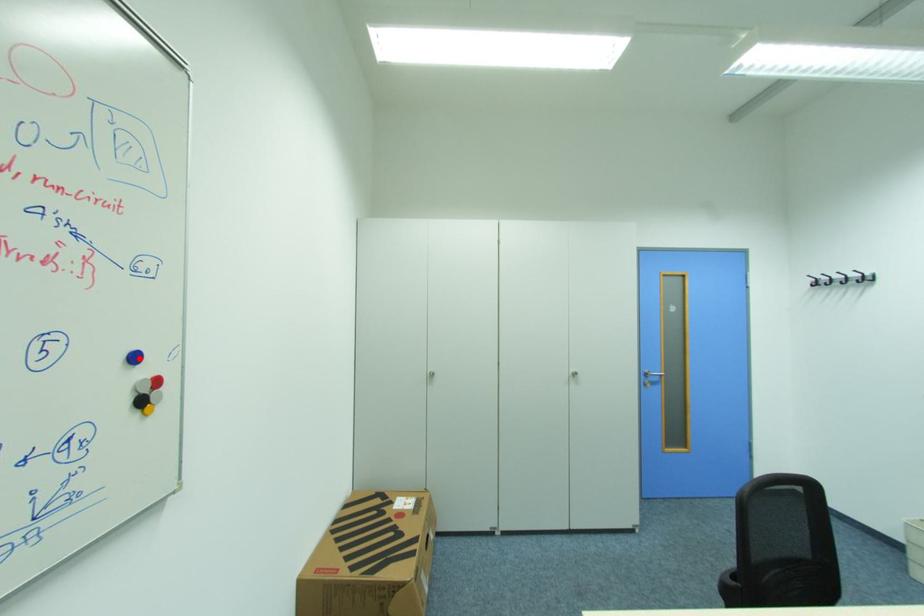
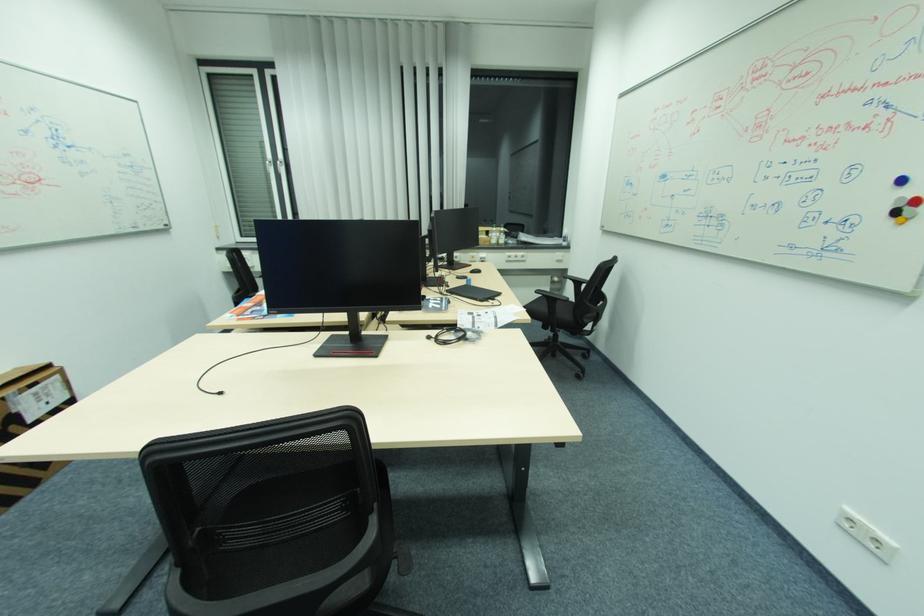
Find the pixel in the second image that matches the highlighted location in the first image.

(908, 180)